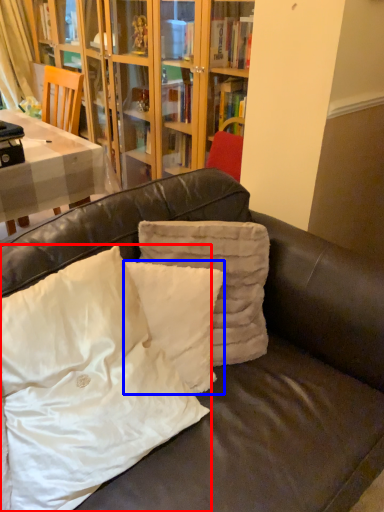
Question: Among these objects, which one is farthest to the camera, pillow (highlighted by a red box) or pillow (highlighted by a blue box)?

Choices:
 (A) pillow
 (B) pillow

Answer: (B)